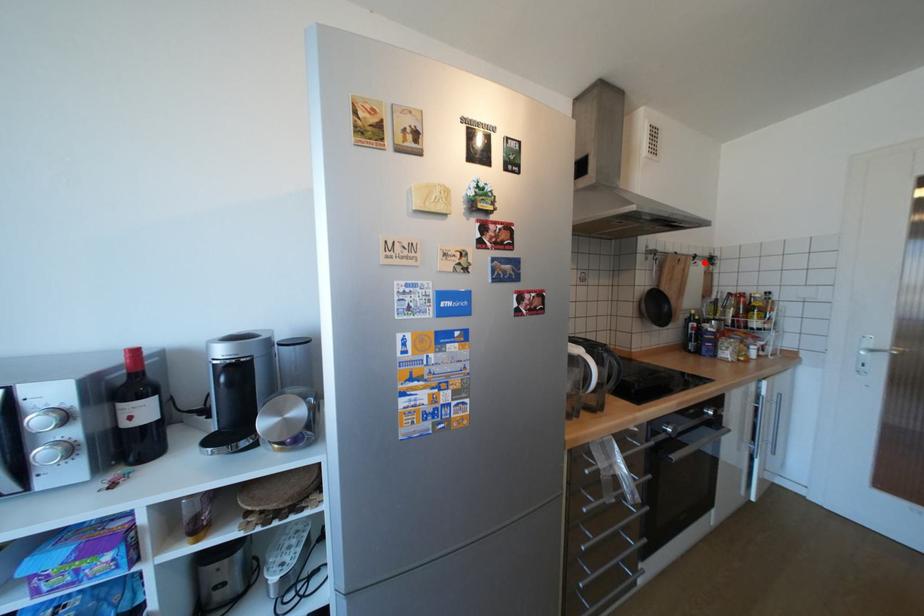
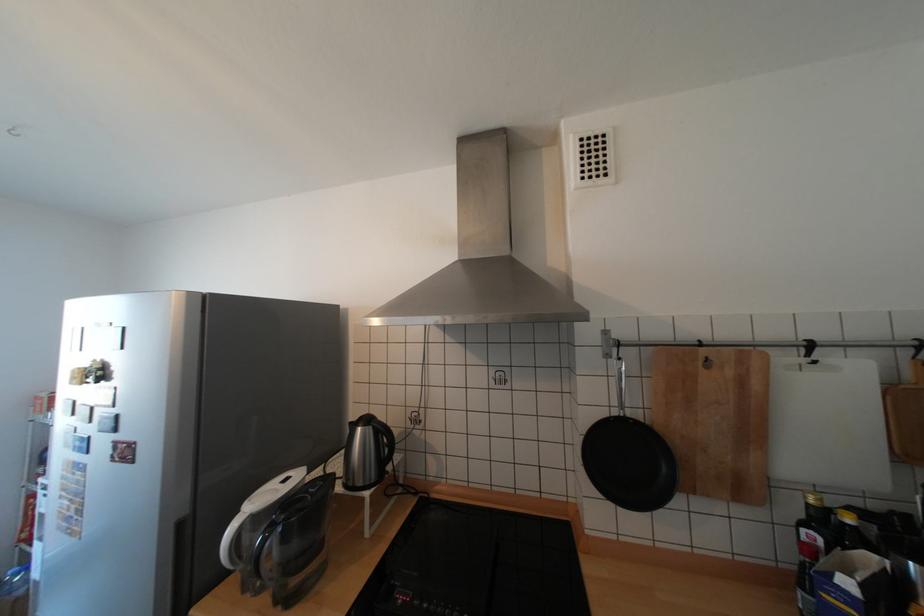
Where in the second image is the point corresponding to the highlighted location from the first image?

(823, 362)